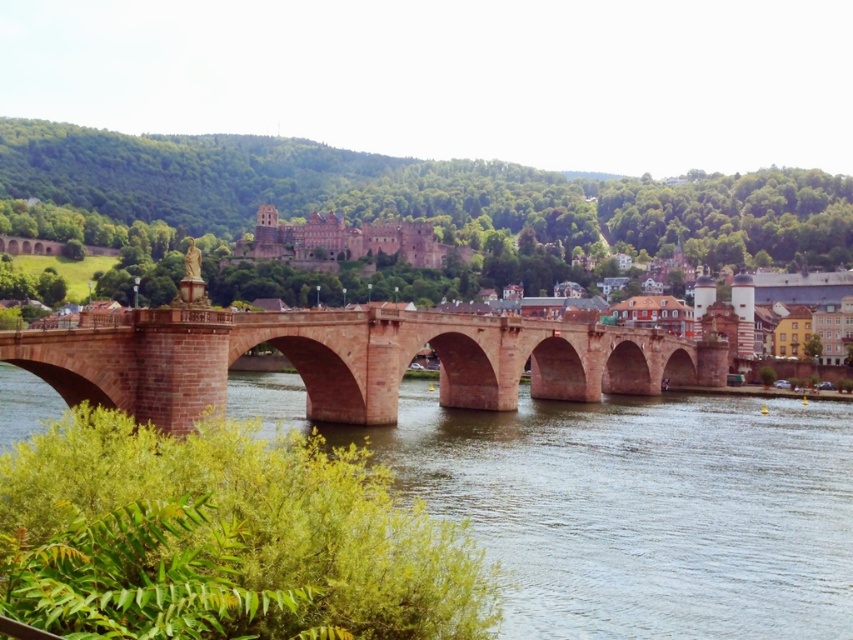
Which of these two, brown stone river at center or reddish-brown stone bridge at center, stands taller?

reddish-brown stone bridge at center is taller.

Describe the element at coordinates (642, 509) in the screenshot. I see `brown stone river at center` at that location.

Who is more forward, (755, 424) or (38, 364)?

Point (38, 364)

This screenshot has width=853, height=640. What are the coordinates of `brown stone river at center` in the screenshot? It's located at tap(642, 509).

Who is higher up, brown stone river at center or brown stone bridge at center?

Positioned higher is brown stone bridge at center.

Measure the distance from brown stone river at center to brown stone bridge at center.

brown stone river at center and brown stone bridge at center are 58.13 meters apart from each other.

Between point (630, 625) and point (682, 310), which one is positioned in front?

Point (630, 625)

Locate an element on the screen. brown stone river at center is located at coordinates (642, 509).

Does reddish-brown stone bridge at center have a greater width compared to brown stone bridge at center?

Incorrect, reddish-brown stone bridge at center's width does not surpass brown stone bridge at center's.

Between point (399, 316) and point (422, 224), which one is positioned in front?

Point (399, 316) is in front.

Image resolution: width=853 pixels, height=640 pixels. I want to click on reddish-brown stone bridge at center, so click(351, 358).